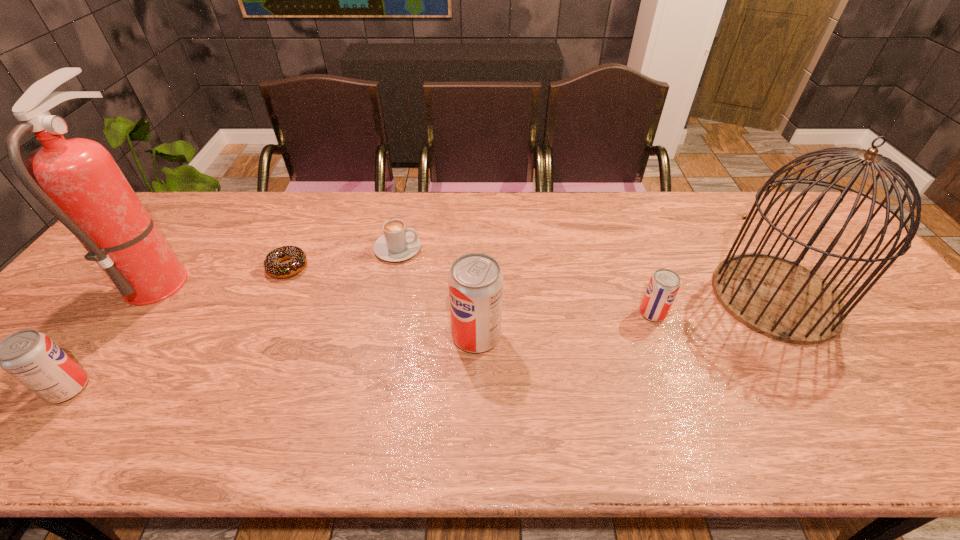
Where is `location for an additional pop_(soda) to make spacing equal`? Image resolution: width=960 pixels, height=540 pixels. location for an additional pop_(soda) to make spacing equal is located at coordinates (282, 361).